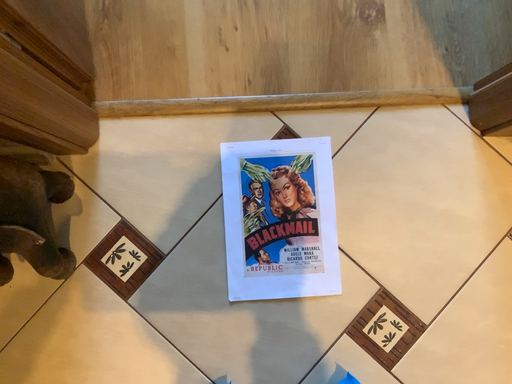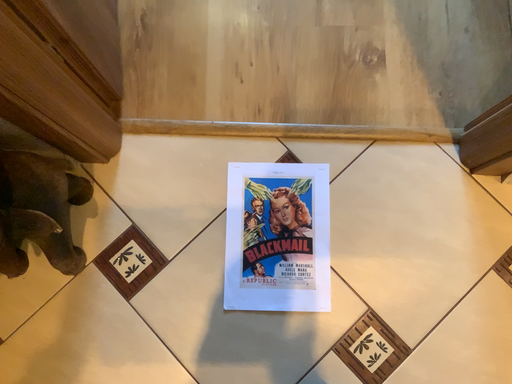
Question: How did the camera likely rotate when shooting the video?

Choices:
 (A) rotated upward
 (B) rotated downward

Answer: (A)